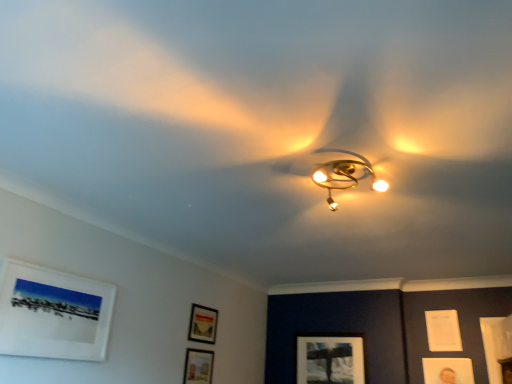
Question: Considering the relative positions of gold metallic fan at center and matte black picture frame at lower center, the fourth picture frame in the back-to-front sequence, in the image provided, is gold metallic fan at center to the right of matte black picture frame at lower center, the fourth picture frame in the back-to-front sequence, from the viewer's perspective?

Choices:
 (A) no
 (B) yes

Answer: (B)

Question: Is gold metallic fan at center located outside matte black picture frame at lower center, the 3th picture frame from the front?

Choices:
 (A) no
 (B) yes

Answer: (B)

Question: Is gold metallic fan at center shorter than matte black picture frame at lower center, acting as the 3th picture frame starting from the left?

Choices:
 (A) no
 (B) yes

Answer: (B)

Question: Can matte black picture frame at lower center, which is the fourth picture frame in right-to-left order, be found inside gold metallic fan at center?

Choices:
 (A) yes
 (B) no

Answer: (B)

Question: From a real-world perspective, is gold metallic fan at center physically below matte black picture frame at lower center, acting as the 3th picture frame starting from the left?

Choices:
 (A) no
 (B) yes

Answer: (A)

Question: Is gold metallic fan at center positioned behind matte black picture frame at lower center, acting as the 3th picture frame starting from the left?

Choices:
 (A) yes
 (B) no

Answer: (B)

Question: Is gold metallic chandelier at center a part of white paper at upper right, the 2th picture frame from the back?

Choices:
 (A) yes
 (B) no

Answer: (B)

Question: Is white paper at upper right, which is the sixth picture frame from left to right, wider than gold metallic chandelier at center?

Choices:
 (A) yes
 (B) no

Answer: (B)

Question: Is white paper at upper right, which is the sixth picture frame from left to right, outside of gold metallic chandelier at center?

Choices:
 (A) yes
 (B) no

Answer: (A)

Question: Considering the relative positions of white paper at upper right, the 1th picture frame from the right, and gold metallic chandelier at center in the image provided, is white paper at upper right, the 1th picture frame from the right, in front of gold metallic chandelier at center?

Choices:
 (A) yes
 (B) no

Answer: (B)

Question: Can you confirm if white paper at upper right, the 1th picture frame from the right, is bigger than gold metallic chandelier at center?

Choices:
 (A) yes
 (B) no

Answer: (B)

Question: Does white paper at upper right, which appears as the fifth picture frame when viewed from the front, have a smaller size compared to gold metallic chandelier at center?

Choices:
 (A) no
 (B) yes

Answer: (B)

Question: Is matte white picture frame at lower center, the 6th picture frame positioned from the front, to the left of white matte picture frame at upper left, the first picture frame from the left, from the viewer's perspective?

Choices:
 (A) no
 (B) yes

Answer: (A)